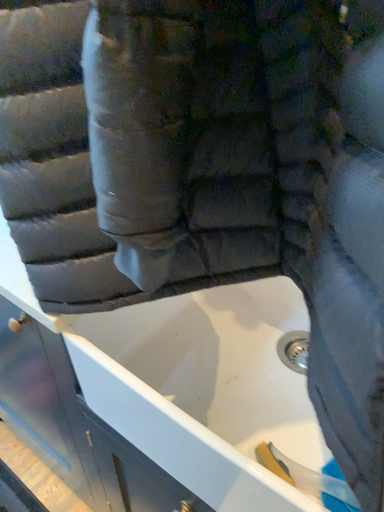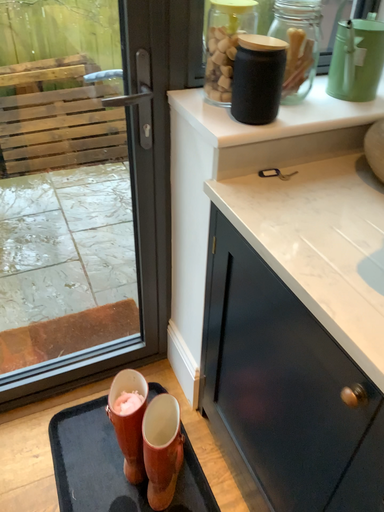
Question: Which way did the camera rotate in the video?

Choices:
 (A) rotated left
 (B) rotated right

Answer: (A)